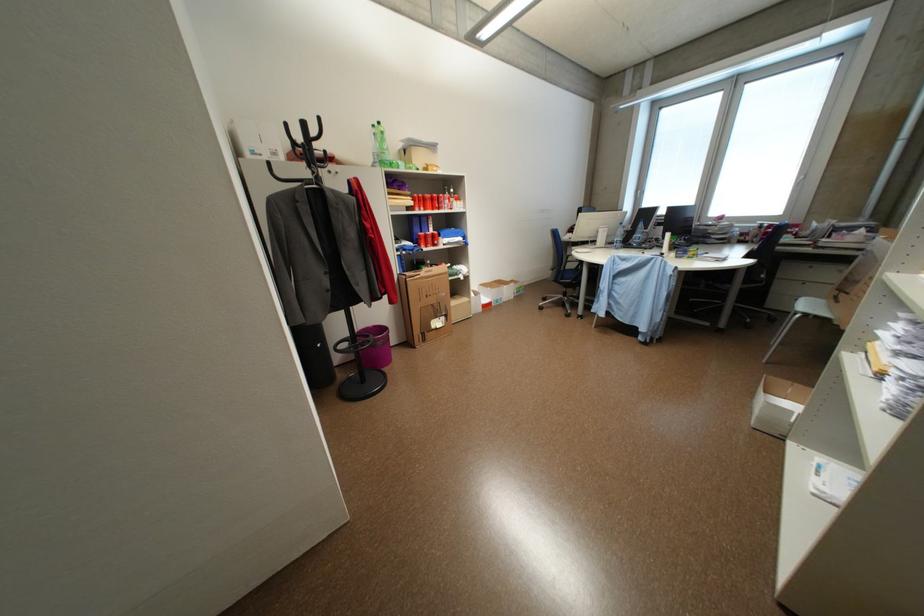
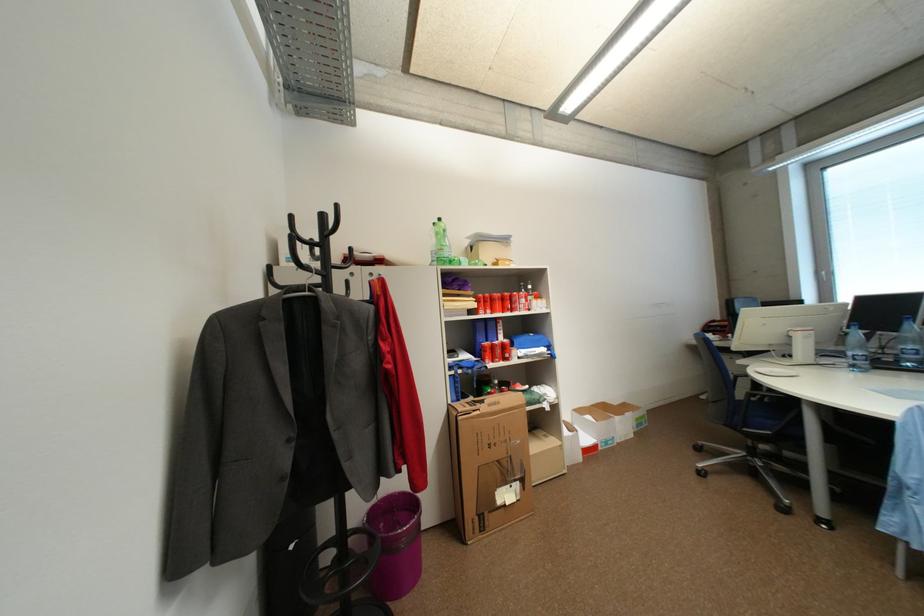
Question: Which direction would the cameraman need to move to produce the second image? Reply with the corresponding letter.

Choices:
 (A) Left
 (B) Right
 (C) Forward
 (D) Backward

Answer: (C)